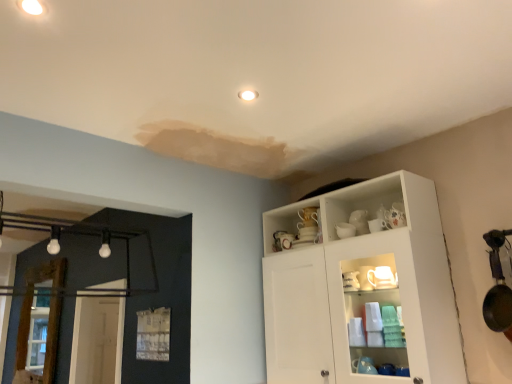
Where is `white matte cabinet at upper right`? The width and height of the screenshot is (512, 384). white matte cabinet at upper right is located at coordinates (362, 290).

What do you see at coordinates (362, 290) in the screenshot? I see `white matte cabinet at upper right` at bounding box center [362, 290].

What is the approximate width of wooden screen door at left?

2.89 inches.

In order to click on wooden screen door at left in this screenshot , I will do `click(48, 315)`.

Describe the element at coordinates (48, 315) in the screenshot. I see `wooden screen door at left` at that location.

Locate an element on the screen. white matte cabinet at upper right is located at coordinates [x=362, y=290].

Between white matte cabinet at upper right and wooden screen door at left, which one appears on the left side from the viewer's perspective?

wooden screen door at left.

Is white matte cabinet at upper right in front of or behind wooden screen door at left in the image?

white matte cabinet at upper right is positioned closer to the viewer than wooden screen door at left.

Is point (426, 185) less distant than point (54, 278)?

Yes, it is.

From the image's perspective, which is below, white matte cabinet at upper right or wooden screen door at left?

wooden screen door at left is shown below in the image.

From the picture: From a real-world perspective, is white matte cabinet at upper right physically above wooden screen door at left?

Yes, from a real-world perspective, white matte cabinet at upper right is above wooden screen door at left.

Can you confirm if white matte cabinet at upper right is wider than wooden screen door at left?

Correct, the width of white matte cabinet at upper right exceeds that of wooden screen door at left.

Between white matte cabinet at upper right and wooden screen door at left, which one has more height?

Standing taller between the two is white matte cabinet at upper right.

Can you confirm if white matte cabinet at upper right is smaller than wooden screen door at left?

Incorrect, white matte cabinet at upper right is not smaller in size than wooden screen door at left.

Is white matte cabinet at upper right completely or partially outside of wooden screen door at left?

That's correct, white matte cabinet at upper right is outside of wooden screen door at left.

Would you consider white matte cabinet at upper right to be distant from wooden screen door at left?

Yes.

Is white matte cabinet at upper right positioned with its back to wooden screen door at left?

white matte cabinet at upper right is not turned away from wooden screen door at left.

How many degrees apart are the facing directions of white matte cabinet at upper right and wooden screen door at left?

The angle between the facing direction of white matte cabinet at upper right and the facing direction of wooden screen door at left is 0.274 degrees.

In the image, there is a white matte cabinet at upper right. In order to click on screen door below it (from the image's perspective) in this screenshot , I will do `click(48, 315)`.

Can you confirm if wooden screen door at left is positioned to the left of white matte cabinet at upper right?

Correct, you'll find wooden screen door at left to the left of white matte cabinet at upper right.

Is wooden screen door at left closer to the viewer compared to white matte cabinet at upper right?

That is False.

Which is further, (53,321) or (385,298)?

The point (53,321) is more distant.

From the image's perspective, is wooden screen door at left located above white matte cabinet at upper right?

No.

From a real-world perspective, relative to white matte cabinet at upper right, is wooden screen door at left vertically above or below?

From a real-world perspective, wooden screen door at left is physically below white matte cabinet at upper right.

Considering the sizes of objects wooden screen door at left and white matte cabinet at upper right in the image provided, who is thinner, wooden screen door at left or white matte cabinet at upper right?

wooden screen door at left is thinner.

Which of these two, wooden screen door at left or white matte cabinet at upper right, stands shorter?

wooden screen door at left is shorter.

Based on their sizes in the image, would you say wooden screen door at left is bigger or smaller than white matte cabinet at upper right?

wooden screen door at left is smaller than white matte cabinet at upper right.

Is wooden screen door at left not inside white matte cabinet at upper right?

Absolutely, wooden screen door at left is external to white matte cabinet at upper right.

Looking at this image, is wooden screen door at left far away from white matte cabinet at upper right?

wooden screen door at left is far away from white matte cabinet at upper right.

Is wooden screen door at left aimed at white matte cabinet at upper right?

No, wooden screen door at left is not oriented towards white matte cabinet at upper right.

This screenshot has height=384, width=512. In order to click on cupboard on the right of wooden screen door at left in this screenshot , I will do `click(362, 290)`.

Find the location of `screen door that appears below the white matte cabinet at upper right (from a real-world perspective)`. screen door that appears below the white matte cabinet at upper right (from a real-world perspective) is located at coordinates (48, 315).

Image resolution: width=512 pixels, height=384 pixels. What are the coordinates of `screen door below the white matte cabinet at upper right (from the image's perspective)` in the screenshot? It's located at (48, 315).